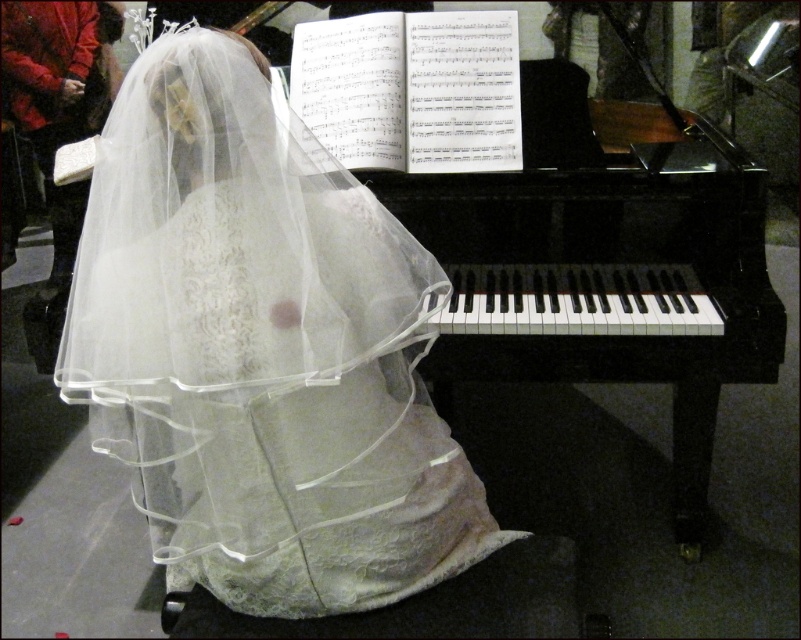
Who is higher up, white lace dress at center or black polished piano at center?

black polished piano at center

Between point (248, 49) and point (566, 280), which one is positioned in front?

Point (248, 49) is in front.

Who is more forward, (224, 552) or (695, 403)?

Point (224, 552) is in front.

Image resolution: width=801 pixels, height=640 pixels. Identify the location of white lace dress at center. (260, 349).